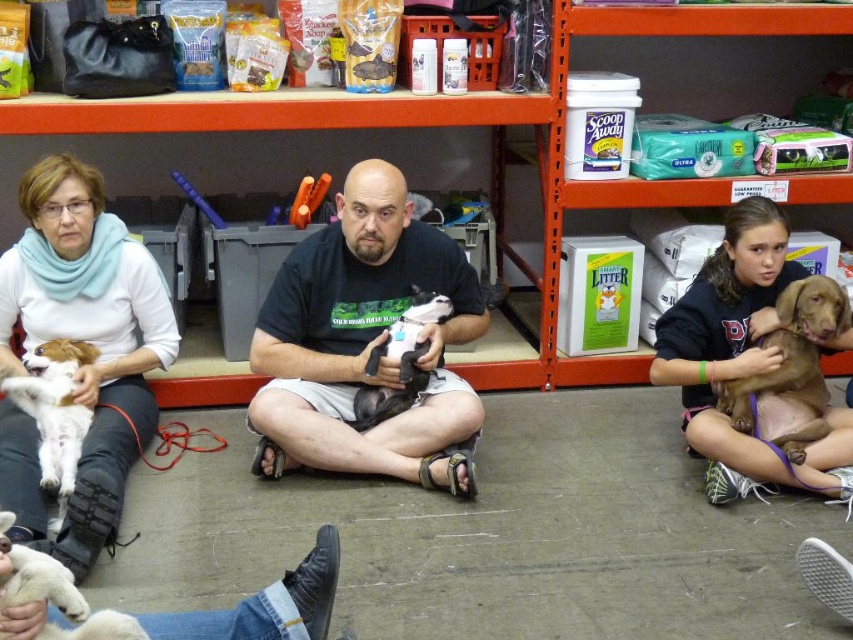
You are a photographer trying to capture a closeup of the black soft fabric dog at center without the white soft scarf at upper left appearing in the frame. Given that your camera has a fixed focal length and you can only move forward or backward, can you estimate whether moving closer to the subjects will help achieve this?

The distance between the white soft scarf at upper left and the black soft fabric dog at center is 33.48 inches. Moving closer to the subjects would decrease the apparent distance between them in the frame, making it harder to exclude the white soft scarf at upper left. To avoid including the scarf, you should move farther away instead, which would make both subjects smaller but increase the space between them in the image.

You are a photographer trying to capture a photo of the black soft fabric dog at center. You notice the white soft scarf at upper left might block the view. Based on their positions, can you adjust your angle to avoid the scarf?

The white soft scarf at upper left is to the left of the black soft fabric dog at center, so moving your camera to the right side of the dog would avoid the scarf.

You are organizing a pet adoption event and need to place two dogs in separate kennels. The kennel for the brown furry dog at center right must be placed above the kennel for the white fluffy dog at lower left. Based on their current positions, will this arrangement be possible?

Yes, because the brown furry dog at center right is already located above the white fluffy dog at lower left, so placing their kennels in the same vertical arrangement is feasible.